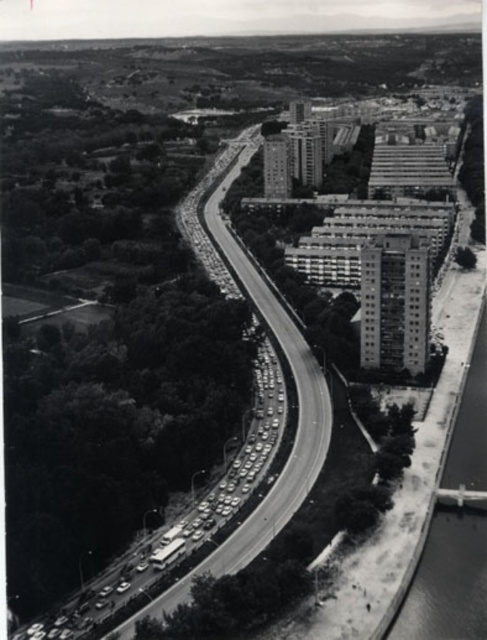
Question: Can you confirm if smooth asphalt highway at lower left is thinner than smooth concrete river at right?

Choices:
 (A) yes
 (B) no

Answer: (A)

Question: Which of the following is the closest to the observer?

Choices:
 (A) smooth concrete river at right
 (B) smooth asphalt highway at lower left

Answer: (A)

Question: Which of the following is the farthest from the observer?

Choices:
 (A) (262, 376)
 (B) (417, 564)

Answer: (A)

Question: Can you confirm if smooth asphalt highway at lower left is smaller than smooth concrete river at right?

Choices:
 (A) no
 (B) yes

Answer: (A)

Question: Does smooth asphalt highway at lower left appear over smooth concrete river at right?

Choices:
 (A) yes
 (B) no

Answer: (A)